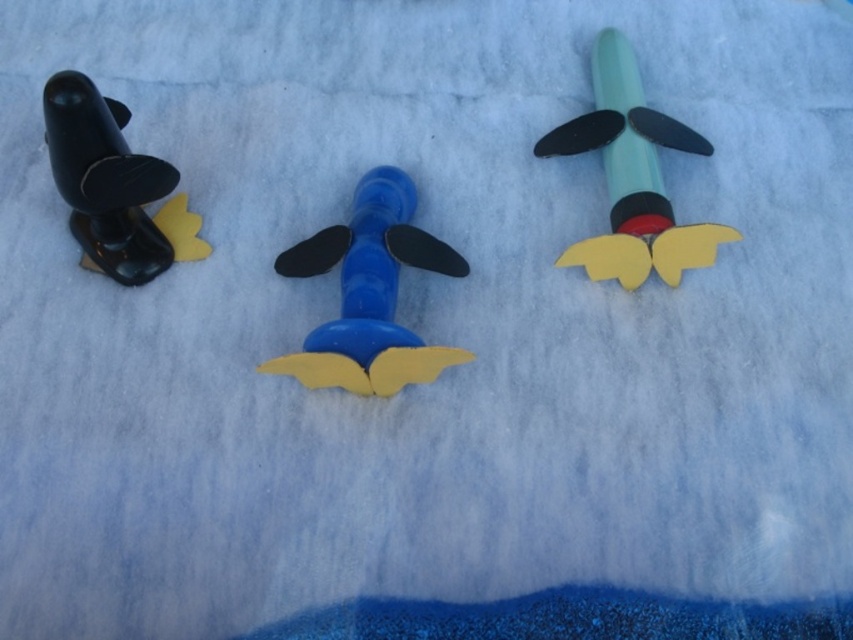
Question: Does matte green rocket at upper right appear on the left side of matte black rocket at left?

Choices:
 (A) no
 (B) yes

Answer: (A)

Question: Which object is positioned farthest from the matte black rocket at left?

Choices:
 (A) matte green rocket at upper right
 (B) blue matte airplane at center

Answer: (A)

Question: Is matte green rocket at upper right positioned before matte black rocket at left?

Choices:
 (A) yes
 (B) no

Answer: (B)

Question: Which of the following is the farthest from the observer?

Choices:
 (A) (604, 49)
 (B) (349, 332)
 (C) (90, 163)

Answer: (A)

Question: Does matte green rocket at upper right appear on the right side of matte black rocket at left?

Choices:
 (A) no
 (B) yes

Answer: (B)

Question: Which point appears closest to the camera in this image?

Choices:
 (A) (680, 138)
 (B) (383, 323)
 (C) (68, 196)

Answer: (B)